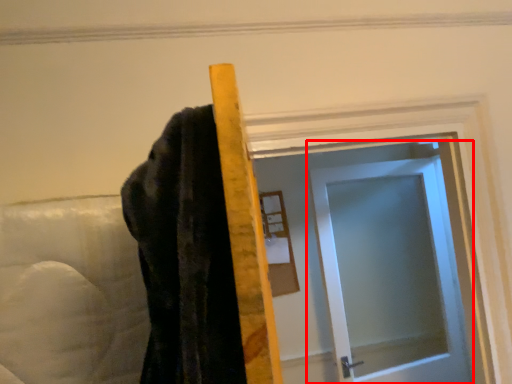
Question: In this image, where is door (annotated by the red box) located relative to mirror?

Choices:
 (A) left
 (B) right

Answer: (B)